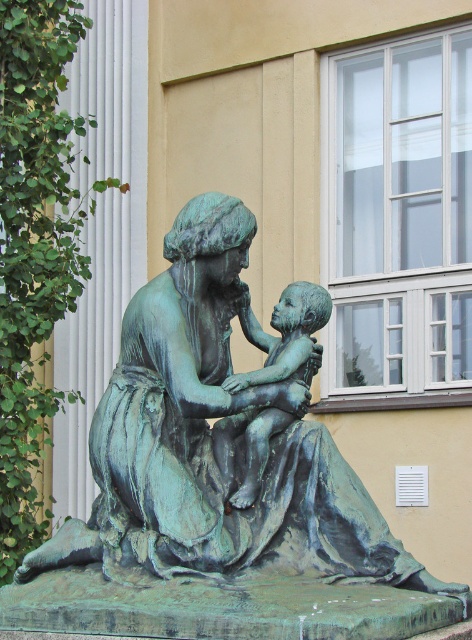
You are standing in a park with a camera that has a maximum focus range of 20 meters. You want to take a photo of the green patina bronze statue at center. Can your camera focus on the statue?

The green patina bronze statue at center and camera are 20.65 meters apart, so the camera cannot focus on the statue since it is beyond the maximum focus range of 20 meters.

You are an art conservator assessing the spacing between two bronze statues in a garden. You need to place a protective barrier around the green patina bronze statue at center and the bronze statue of child at center. Based on their sizes, which statue requires a larger barrier area?

The green patina bronze statue at center requires a larger barrier area since it might be wider than the bronze statue of child at center.